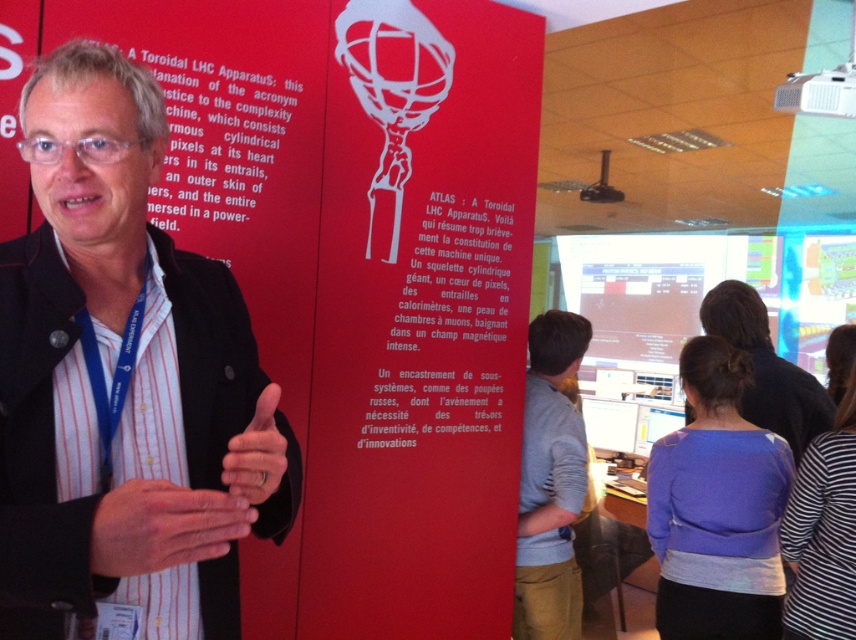
You are organizing a photo shoot and need to ensure that the black matte jacket at left and the gray cotton shirt at center are visible in the frame. Given their sizes, which object should you prioritize placing closer to the camera to maintain clarity?

The black matte jacket at left is larger in size compared to the gray cotton shirt at center, so you should prioritize placing the black matte jacket at left closer to the camera to ensure both objects are clearly visible.